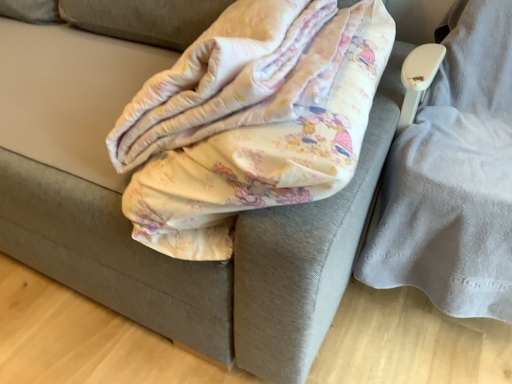
Question: Considering the positions of point (504, 188) and point (195, 185), is point (504, 188) closer or farther from the camera than point (195, 185)?

Choices:
 (A) farther
 (B) closer

Answer: (A)

Question: From a real-world perspective, is gray fabric swivel chair at right positioned above or below fluffy cotton blanket at center?

Choices:
 (A) above
 (B) below

Answer: (B)

Question: Considering their positions, is gray fabric swivel chair at right located in front of or behind fluffy cotton blanket at center?

Choices:
 (A) behind
 (B) front

Answer: (A)

Question: Is fluffy cotton blanket at center wider or thinner than gray fabric swivel chair at right?

Choices:
 (A) thin
 (B) wide

Answer: (B)

Question: Considering the positions of fluffy cotton blanket at center and gray fabric swivel chair at right in the image, is fluffy cotton blanket at center taller or shorter than gray fabric swivel chair at right?

Choices:
 (A) tall
 (B) short

Answer: (B)

Question: Considering their positions, is fluffy cotton blanket at center located in front of or behind gray fabric swivel chair at right?

Choices:
 (A) behind
 (B) front

Answer: (B)

Question: From a real-world perspective, is fluffy cotton blanket at center above or below gray fabric swivel chair at right?

Choices:
 (A) below
 (B) above

Answer: (B)